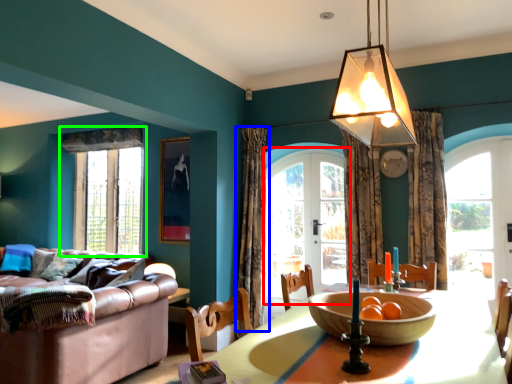
Question: Estimate the real-world distances between objects in this image. Which object is closer to screen door (highlighted by a red box), curtain (highlighted by a blue box) or window (highlighted by a green box)?

Choices:
 (A) curtain
 (B) window

Answer: (A)